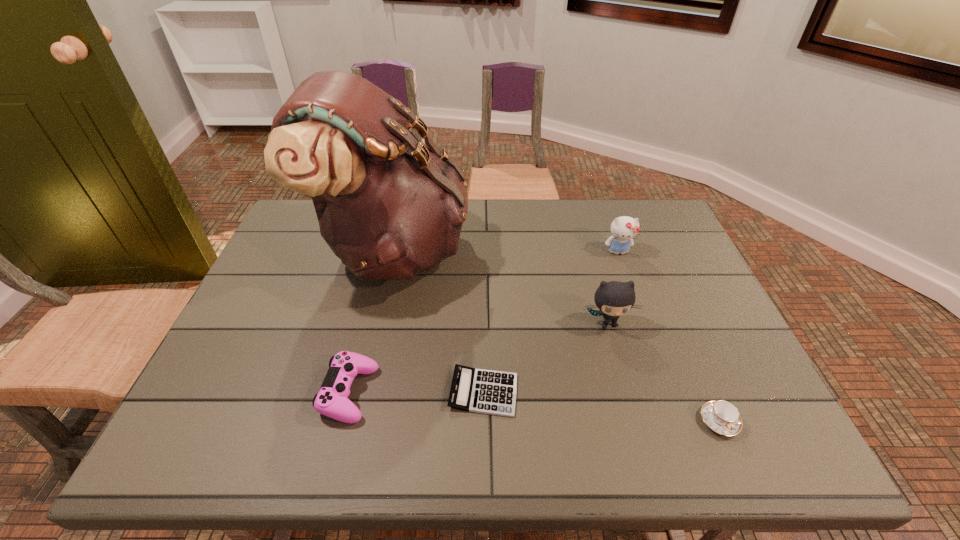
The image size is (960, 540). I want to click on vacant space situated on the back of the control, so click(x=377, y=281).

You are a GUI agent. You are given a task and a screenshot of the screen. Output one action in this format:
    pyautogui.click(x=<x>, y=<y>)
    Task: Click on the vacant space located 0.350m on the left of the calculator
    This screenshot has width=960, height=540.
    Given the screenshot: What is the action you would take?
    pyautogui.click(x=290, y=392)

At what (x,y) coordinates should I click in order to perform the action: click on object that is at the far edge. Please return your answer as a coordinate pair (x, y). The image size is (960, 540). Looking at the image, I should click on (388, 206).

Identify the location of control at the near edge. Image resolution: width=960 pixels, height=540 pixels. (331, 401).

Image resolution: width=960 pixels, height=540 pixels. I want to click on teacup present at the near edge, so 721,416.

This screenshot has width=960, height=540. I want to click on object located in the left edge section of the desktop, so click(x=388, y=206).

The width and height of the screenshot is (960, 540). Identify the location of kitten located at the right edge. (624, 229).

Identify the location of teacup located in the right edge section of the desktop. (721, 416).

Where is `object located in the far left corner section of the desktop`? object located in the far left corner section of the desktop is located at coordinates (388, 206).

Locate an element on the screen. object present at the near right corner is located at coordinates click(721, 416).